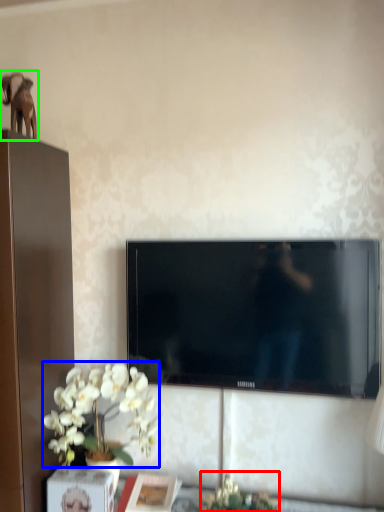
Question: Which object is positioned closest to plant (highlighted by a red box)? Select from flower (highlighted by a blue box) and animal (highlighted by a green box).

Choices:
 (A) flower
 (B) animal

Answer: (A)